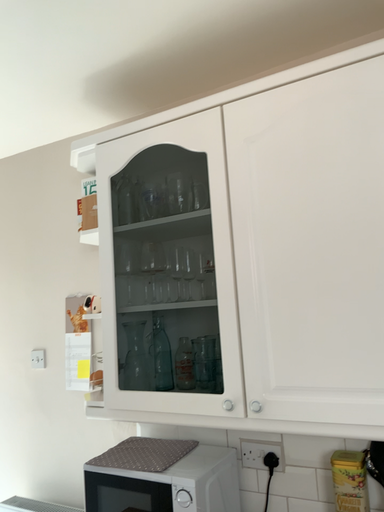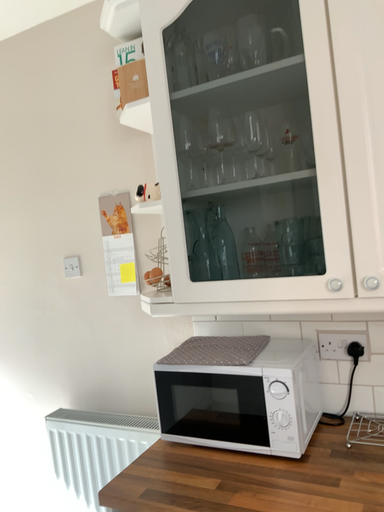
Question: How did the camera likely rotate when shooting the video?

Choices:
 (A) rotated upward
 (B) rotated downward

Answer: (B)